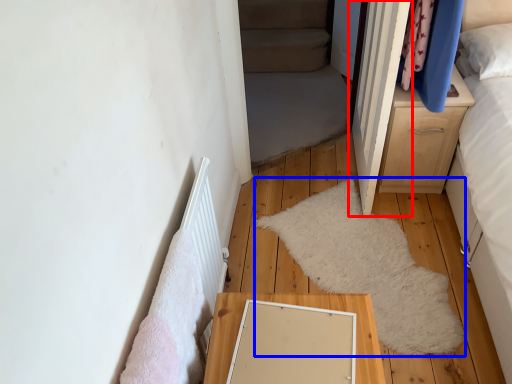
Question: Which of the following is the closest to the observer, door (highlighted by a red box) or mat (highlighted by a blue box)?

Choices:
 (A) door
 (B) mat

Answer: (A)